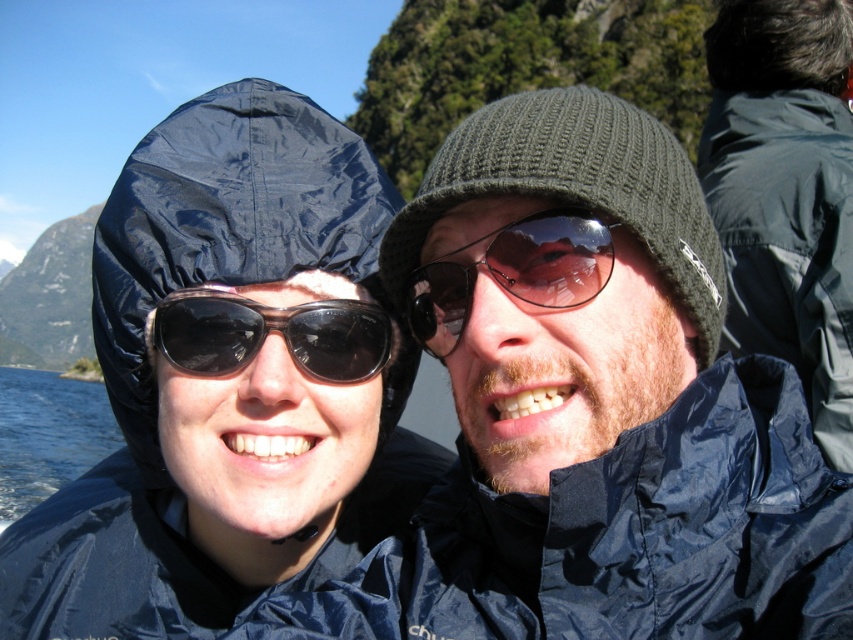
Which is more to the right, sunglasses at center or blue water at lower left?

Positioned to the right is sunglasses at center.

Measure the distance from sunglasses at center to blue water at lower left.

A distance of 103.63 meters exists between sunglasses at center and blue water at lower left.

Is point (489, 250) farther from viewer compared to point (111, 436)?

No, (489, 250) is closer to viewer.

Where is `sunglasses at center`? This screenshot has width=853, height=640. sunglasses at center is located at coordinates (512, 273).

Is matte black raincoat at left wider than dark blue nylon jacket at upper right?

Indeed, matte black raincoat at left has a greater width compared to dark blue nylon jacket at upper right.

Does matte black raincoat at left have a lesser width compared to dark blue nylon jacket at upper right?

No.

Measure the distance between matte black raincoat at left and camera.

matte black raincoat at left is 56.10 feet from camera.

I want to click on matte black raincoat at left, so click(x=229, y=381).

Which is below, matte blue jacket at center or matte black raincoat at left?

matte blue jacket at center

The height and width of the screenshot is (640, 853). Describe the element at coordinates (602, 397) in the screenshot. I see `matte blue jacket at center` at that location.

What do you see at coordinates (602, 397) in the screenshot? I see `matte blue jacket at center` at bounding box center [602, 397].

The height and width of the screenshot is (640, 853). Identify the location of matte blue jacket at center. (602, 397).